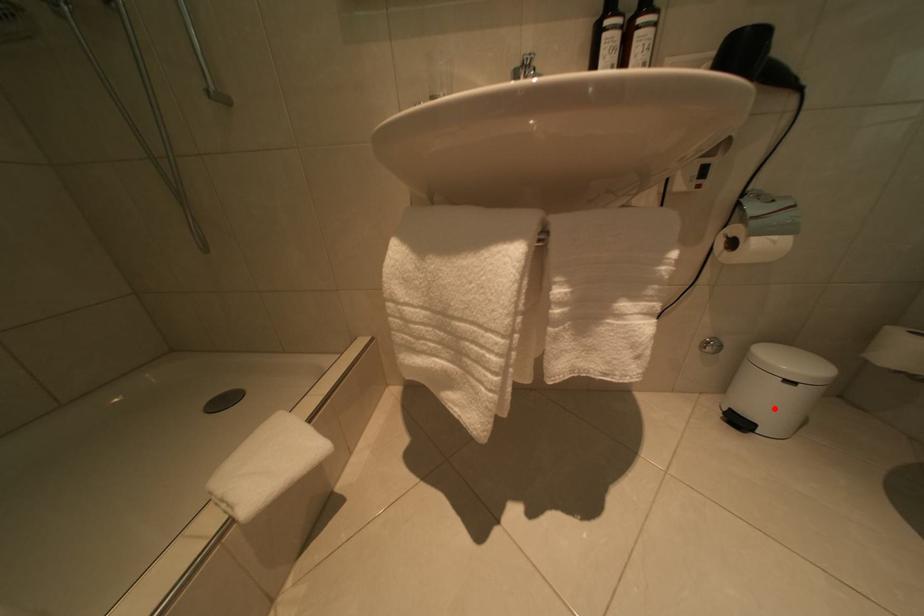
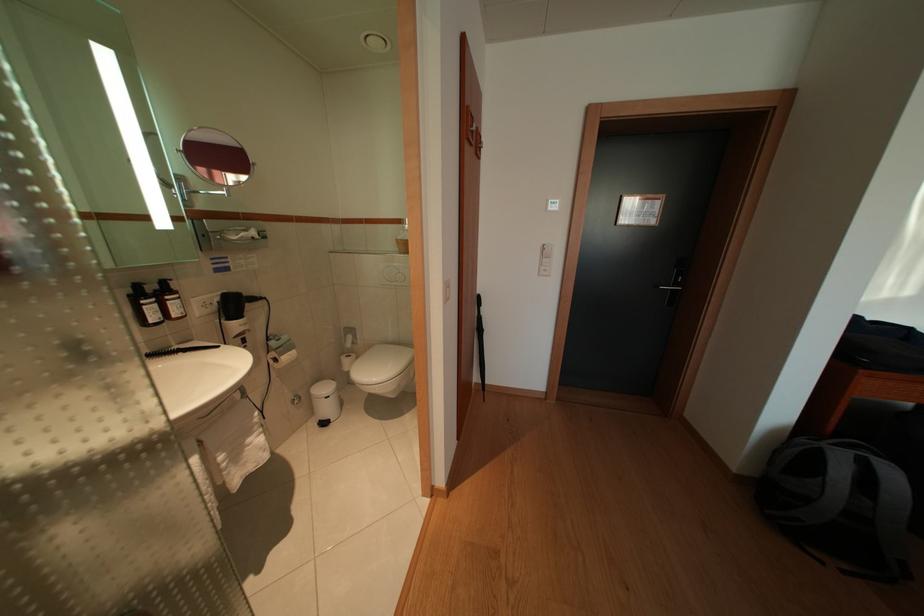
In the second image, find the point that corresponds to the highlighted location in the first image.

(335, 415)